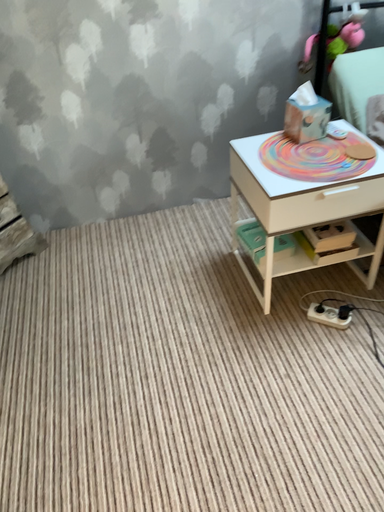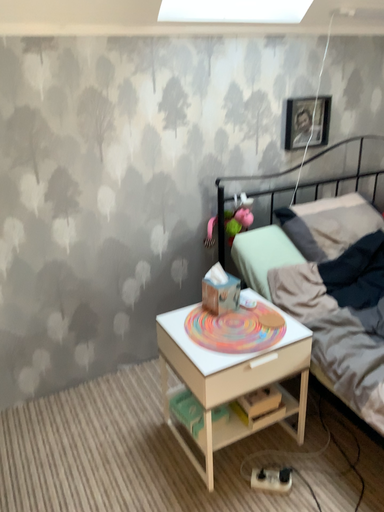
Question: Which way did the camera rotate in the video?

Choices:
 (A) rotated upward
 (B) rotated downward

Answer: (A)